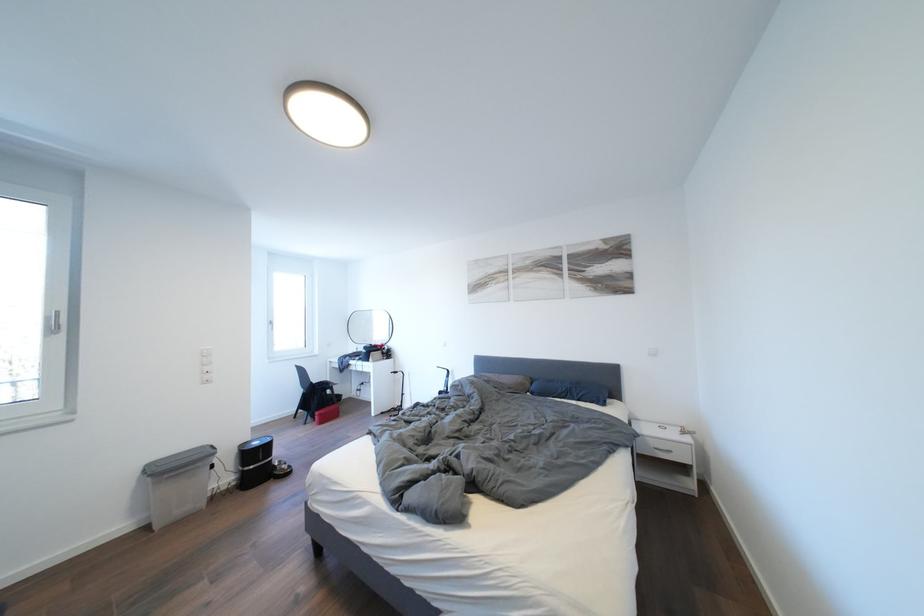
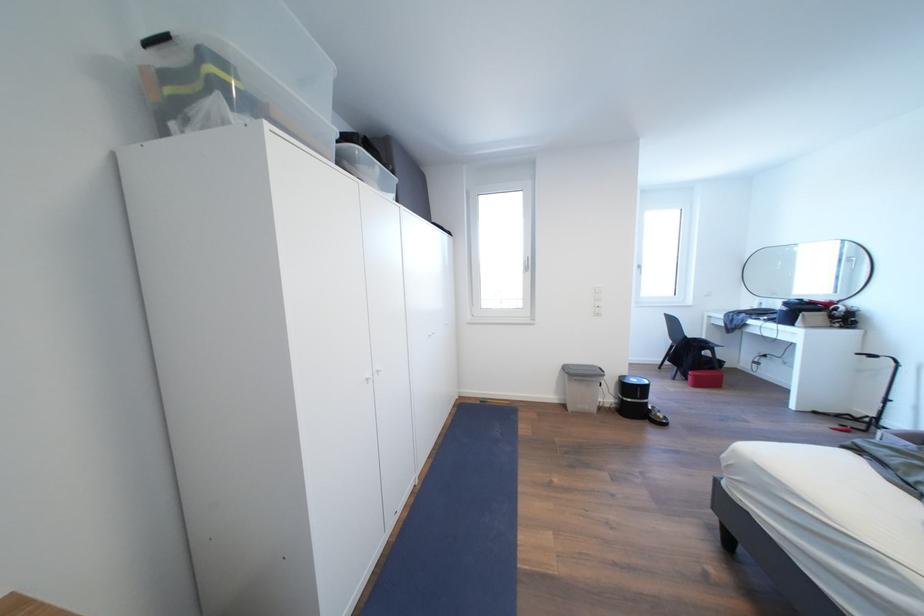
Find the pixel in the second image that matches the point at 329,419 in the first image.

(703, 381)